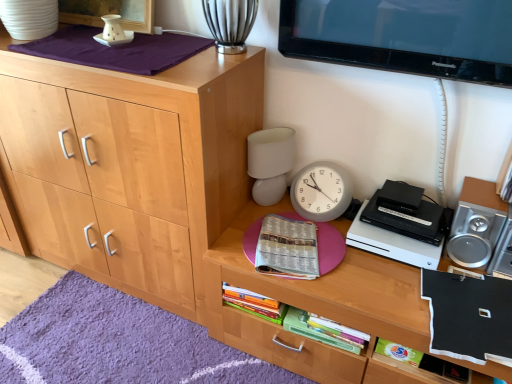
Find the location of a particular element. The width and height of the screenshot is (512, 384). free space above black matte book at lower right, acting as the 1th book starting from the right (from a real-world perspective) is located at coordinates (490, 314).